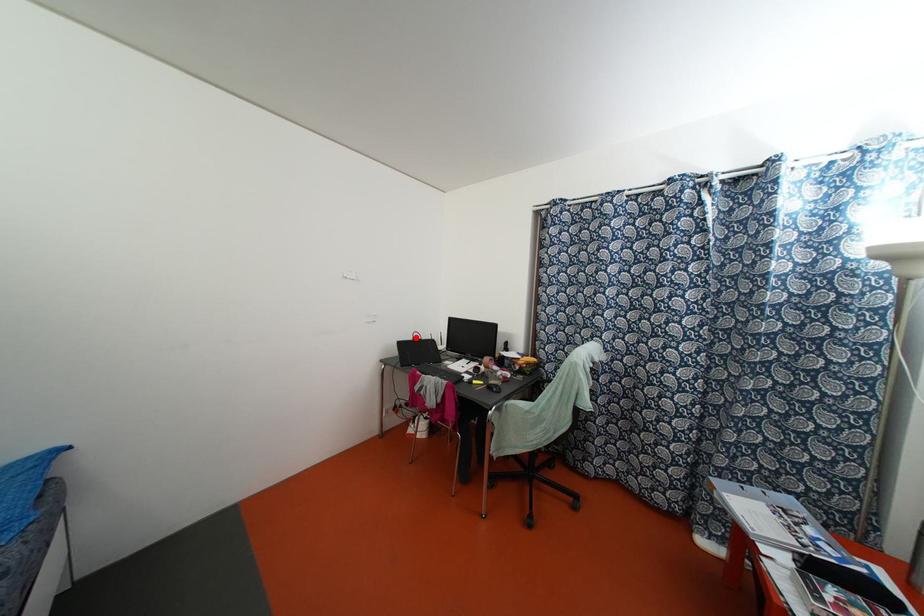
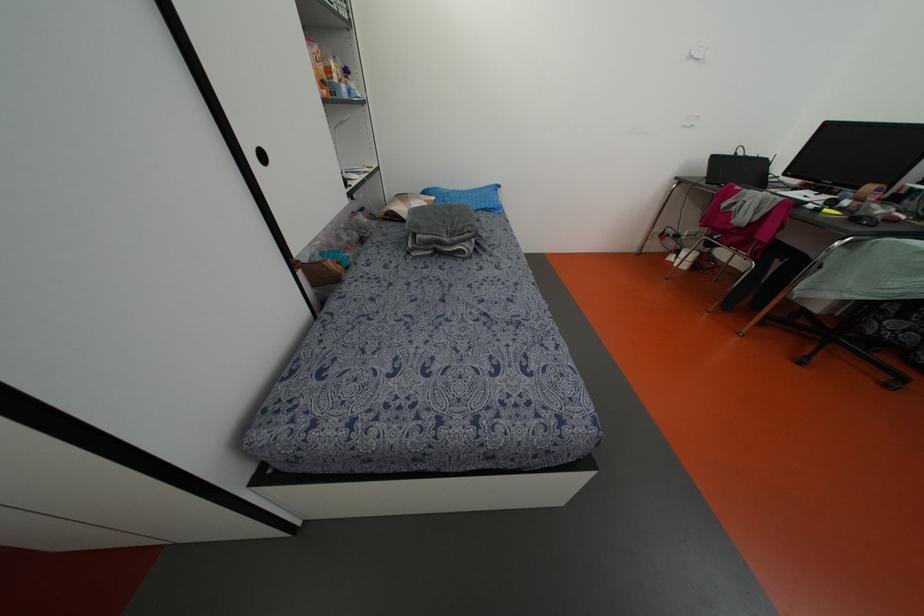
The point at the highlighted location is marked in the first image. Where is the corresponding point in the second image?

(739, 153)